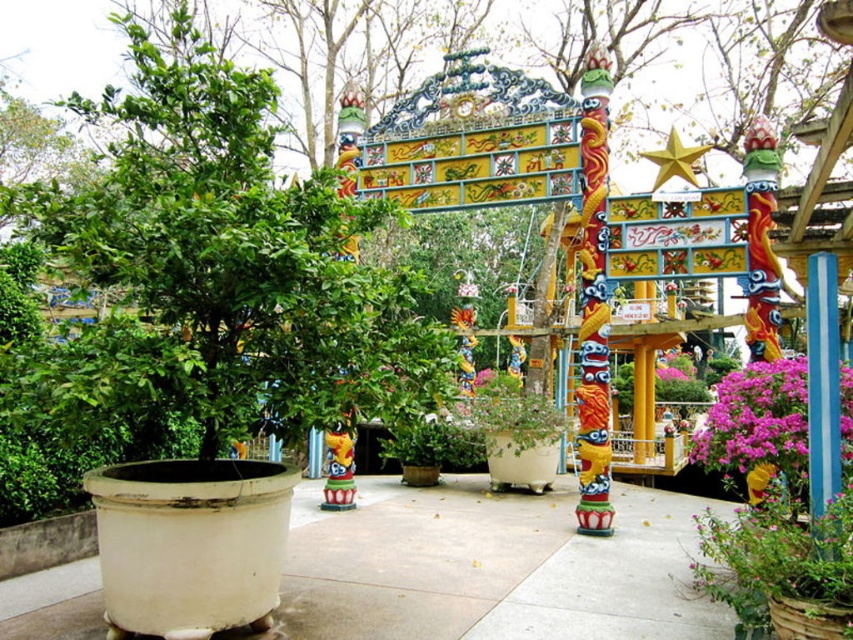
You are standing in front of the entrance gate and want to place a golden star decoration. The gate has two pillars with dragon motifs. Where should you place the golden star so it aligns with the purple matte flowers at center right located at point [756,420]?

The golden star should be placed at point [756,420] where the purple matte flowers at center right are located to ensure alignment.

Based on the photo, you are standing at the entrance of the gate and want to find the green matte tree at center. According to the coordinates provided, in which direction should you look to locate it?

The green matte tree at center is located at coordinates point (231, 257), which means it is positioned slightly to the right and lower center of the image. Since you are facing the entrance gate, you should look towards the lower central area, slightly to the right, to locate the green matte tree at center.